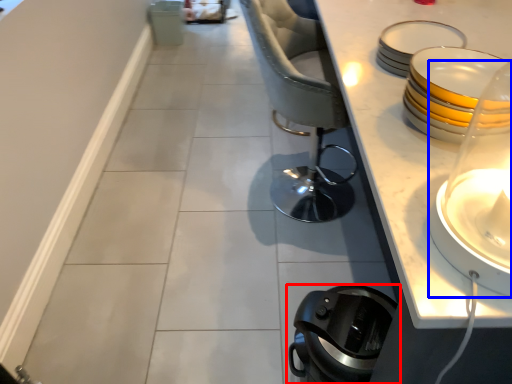
Question: Which point is closer to the camera, home appliance (highlighted by a red box) or candle holder (highlighted by a blue box)?

Choices:
 (A) home appliance
 (B) candle holder

Answer: (B)